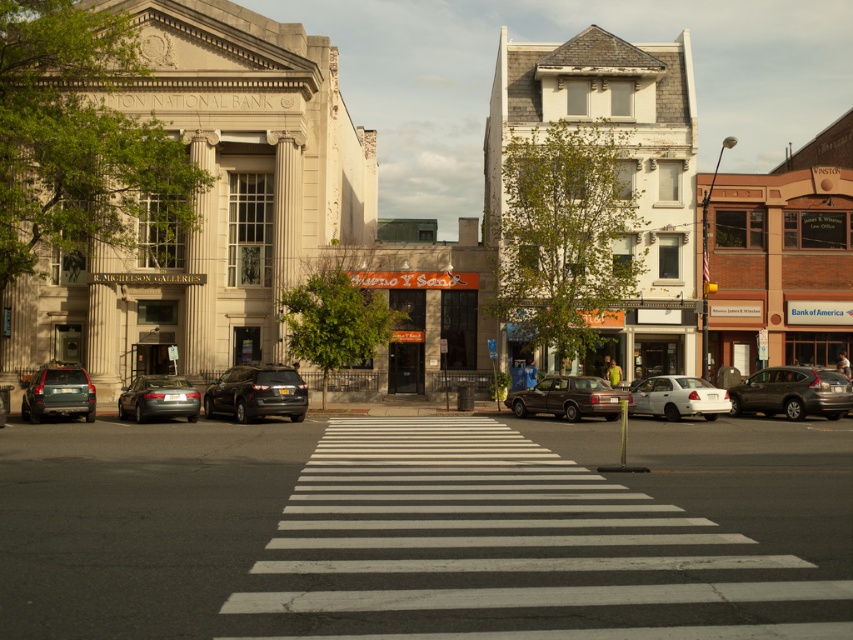
You are a delivery person who needs to park your 10 feet long truck between the shiny black suv at center and the silver metallic sedan at center. Is there enough space between them to fit your truck?

The shiny black suv at center is 8.98 feet away from the silver metallic sedan at center. Since your truck is 10 feet long, there isn not enough space between them to fit your truck.

You are a delivery driver who needs to parallel park your vehicle between the shiny black suv at center and the silver metallic sedan at center. Given that your delivery van is 2.2 meters wide, can you fit it between them?

The shiny black suv at center is wider than the silver metallic sedan at center. However, the exact distance between them isn not provided. Without knowing the space between the two vehicles, it is impossible to determine if the van will fit.

You are a delivery driver who needs to park your truck between the white matte sedan at center and the silver metallic sedan at center. Can your truck, which is 6 meters long, fit in the space between them?

The white matte sedan at center is larger than the silver metallic sedan at center. However, the exact distance between them isn not provided in the scene description. Therefore, it is impossible to determine if the truck can fit based on the given information.